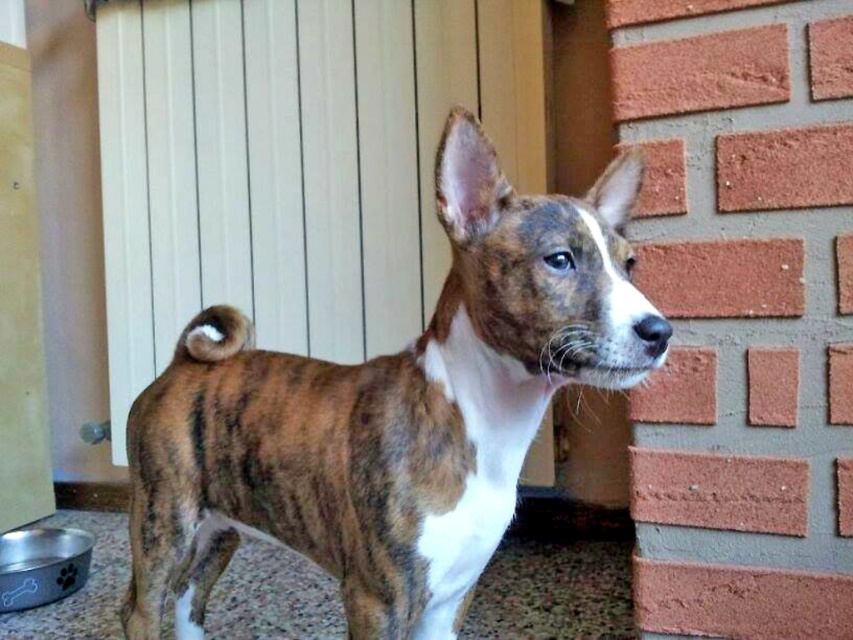
Is point (457, 545) behind point (32, 156)?

No, (457, 545) is closer to viewer.

Which is behind, point (322, 566) or point (10, 269)?

The point (10, 269) is behind.

This screenshot has width=853, height=640. I want to click on brown brindle dog at center, so click(389, 412).

Which of these two, white painted wood door at upper center or wooden door at left, stands shorter?

white painted wood door at upper center

What are the coordinates of `white painted wood door at upper center` in the screenshot? It's located at (293, 163).

Is brown brindle dog at center further to the viewer compared to white painted wood door at upper center?

No, brown brindle dog at center is closer to the viewer.

Where is `brown brindle dog at center`? This screenshot has height=640, width=853. brown brindle dog at center is located at coordinates click(x=389, y=412).